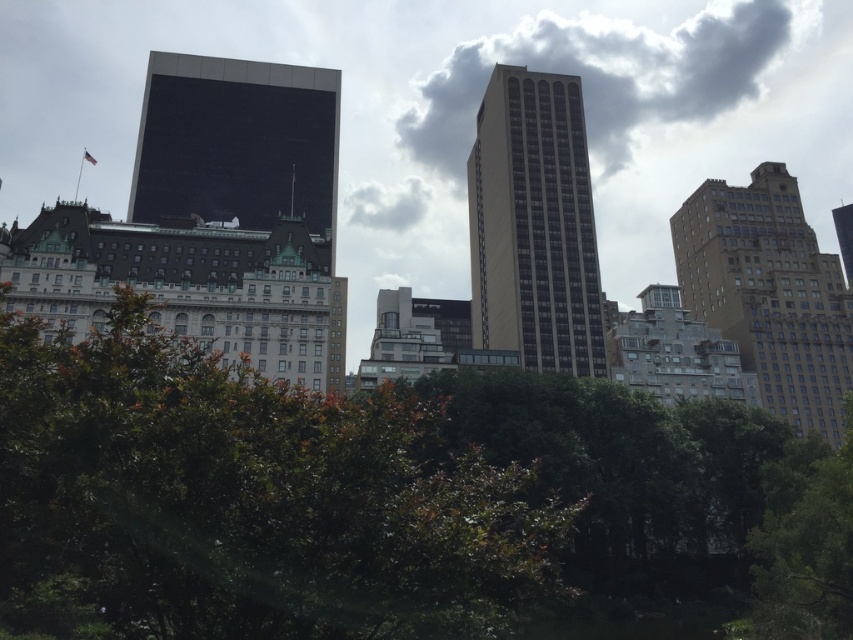
Based on the photo, who is more forward, [183,120] or [721,317]?

Point [721,317] is in front.

Is dark glass skyscraper at center-left above brown brick building at right?

Correct, dark glass skyscraper at center-left is located above brown brick building at right.

Measure the distance between dark glass skyscraper at center-left and camera.

A distance of 88.41 meters exists between dark glass skyscraper at center-left and camera.

At what (x,y) coordinates should I click in order to perform the action: click on dark glass skyscraper at center-left. Please return your answer as a coordinate pair (x, y). This screenshot has width=853, height=640. Looking at the image, I should click on (236, 144).

Which of these two, beige smooth building at center or dark glass skyscraper at center-left, stands shorter?

dark glass skyscraper at center-left is shorter.

Between point (596, 349) and point (267, 193), which one is positioned in front?

Point (596, 349) is in front.

Locate an element on the screen. Image resolution: width=853 pixels, height=640 pixels. beige smooth building at center is located at coordinates (532, 225).

Is point (538, 138) behind point (805, 369)?

Yes.

Describe the element at coordinates (532, 225) in the screenshot. I see `beige smooth building at center` at that location.

Which is in front, point (508, 192) or point (824, 288)?

Point (508, 192)

The height and width of the screenshot is (640, 853). I want to click on beige smooth building at center, so point(532,225).